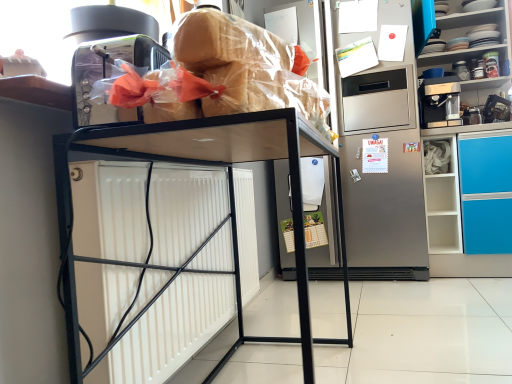
Question: From a real-world perspective, is black metal shelf at center above or below porcelain plates at upper right?

Choices:
 (A) below
 (B) above

Answer: (A)

Question: Is black metal shelf at center bigger or smaller than porcelain plates at upper right?

Choices:
 (A) big
 (B) small

Answer: (B)

Question: Estimate the real-world distances between objects in this image. Which object is farther from the porcelain plates at upper right?

Choices:
 (A) translucent plastic bread at upper center
 (B) black metal shelf at center
 (C) stainless steel refrigerator at center
 (D) bread at upper center

Answer: (A)

Question: Considering the real-world distances, which object is closest to the translucent plastic bread at upper center?

Choices:
 (A) stainless steel refrigerator at center
 (B) bread at upper center
 (C) black metal shelf at center
 (D) porcelain plates at upper right

Answer: (B)